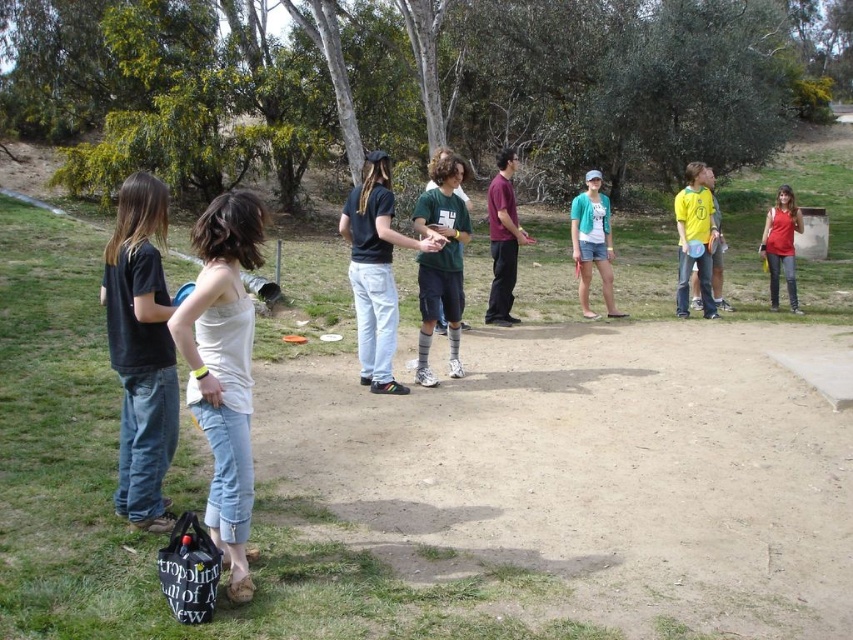
Question: Which of the following is the farthest from the observer?

Choices:
 (A) white cotton tank top at left
 (B) dark blue t-shirt at center
 (C) matte green t-shirt at center

Answer: (C)

Question: Can you confirm if dark blue t-shirt at center is positioned below matte red tank top at right?

Choices:
 (A) no
 (B) yes

Answer: (B)

Question: Does maroon fabric shirt at center have a larger size compared to yellow jersey at right?

Choices:
 (A) no
 (B) yes

Answer: (A)

Question: Which point is farther to the camera?

Choices:
 (A) (700, 198)
 (B) (428, 310)
 (C) (502, 232)
 (D) (782, 224)

Answer: (D)

Question: Which object is closer to the camera taking this photo?

Choices:
 (A) dark blue t-shirt at center
 (B) green jersey at center
 (C) yellow jersey at right
 (D) white cotton tank top at left

Answer: (D)

Question: Is dark blue t-shirt at center wider than yellow jersey at right?

Choices:
 (A) no
 (B) yes

Answer: (B)